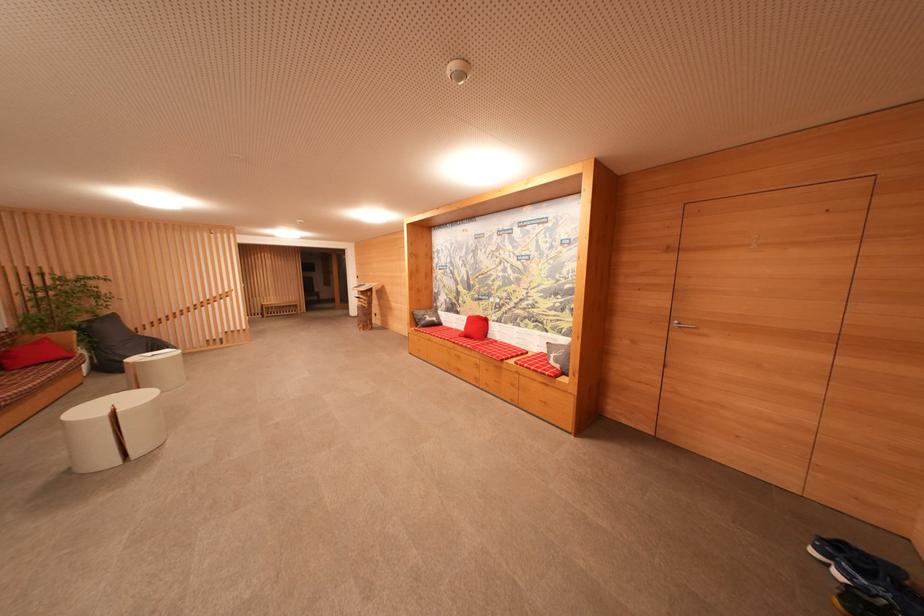
Image resolution: width=924 pixels, height=616 pixels. I want to click on metal door handle, so click(x=682, y=325).